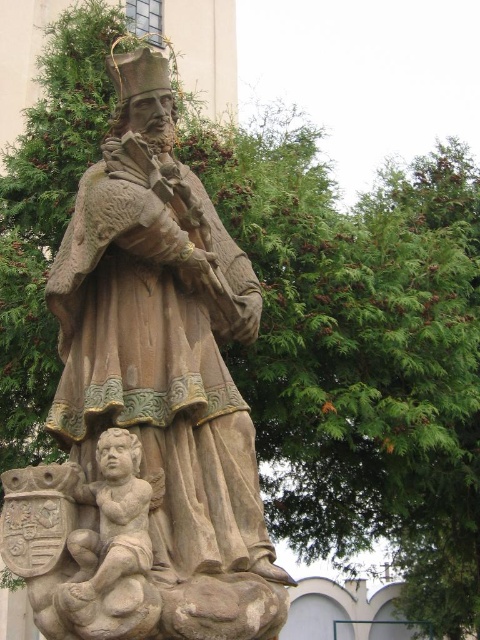
Based on the photo, you are an art student analyzing the statue and the cherub. Which object is bigger in size between the stone statue at center and the smooth stone cherub at lower left?

The stone statue at center is larger in size compared to the smooth stone cherub at lower left.

You are standing in a museum and see the stone statue at center. If you want to take a closer look, how many steps would you need to take to reach it if each step covers 0.75 meters?

The stone statue at center is 26.27 meters away from viewer. Dividing the distance by the step length of 0.75 meters gives approximately 35 steps. However, since you can only take whole steps, you would need to take 35 steps to reach it.